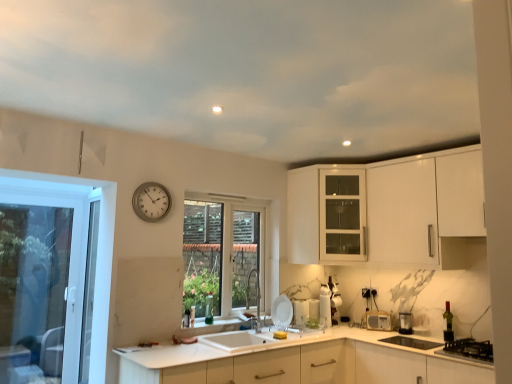
Where is `black matte gas stove at lower right`? This screenshot has height=384, width=512. black matte gas stove at lower right is located at coordinates (469, 350).

The image size is (512, 384). What do you see at coordinates (325, 306) in the screenshot?
I see `white glossy soap dispenser at center, placed as the 2th appliance when sorted from left to right` at bounding box center [325, 306].

The height and width of the screenshot is (384, 512). Find the location of `green glass wine bottle at sink, the 2th wine bottle from the front`. green glass wine bottle at sink, the 2th wine bottle from the front is located at coordinates tap(209, 309).

Describe the element at coordinates (282, 312) in the screenshot. This screenshot has height=384, width=512. I see `white glossy plate at sink, the first appliance positioned from the left` at that location.

What do you see at coordinates (448, 324) in the screenshot? I see `green glass bottle at lower right, positioned as the 2th wine bottle in back-to-front order` at bounding box center [448, 324].

Image resolution: width=512 pixels, height=384 pixels. I want to click on silver metallic clock at upper left, so click(x=151, y=201).

Is green glass wine bottle at sink, which appears as the first wine bottle when viewed from the left, far away from white glossy microwave at lower center, which is the 3th appliance in left-to-right order?

Yes, green glass wine bottle at sink, which appears as the first wine bottle when viewed from the left, and white glossy microwave at lower center, which is the 3th appliance in left-to-right order, are located far from each other.

You are a GUI agent. You are given a task and a screenshot of the screen. Output one action in this format:
    pyautogui.click(x=<x>, y=<y>)
    Task: Click on the 1st wine bottle in front of the white glossy microwave at lower center, which is the 3th appliance in left-to-right order
    
    Given the screenshot: What is the action you would take?
    pyautogui.click(x=209, y=309)

Can you confirm if green glass wine bottle at sink, which is the 1th wine bottle from back to front, is shorter than white glossy microwave at lower center, which is the 3th appliance in left-to-right order?

In fact, green glass wine bottle at sink, which is the 1th wine bottle from back to front, may be taller than white glossy microwave at lower center, which is the 3th appliance in left-to-right order.

In the scene shown: From the image's perspective, is green glass wine bottle at sink, which is the 1th wine bottle from back to front, above or below white glossy microwave at lower center, which is the 3th appliance in left-to-right order?

Based on their image positions, green glass wine bottle at sink, which is the 1th wine bottle from back to front, is located above white glossy microwave at lower center, which is the 3th appliance in left-to-right order.

Considering the sizes of objects transparent glass door at left, marked as the 1th window in a left-to-right arrangement, and silver metallic clock at upper left in the image provided, who is taller, transparent glass door at left, marked as the 1th window in a left-to-right arrangement, or silver metallic clock at upper left?

With more height is transparent glass door at left, marked as the 1th window in a left-to-right arrangement.

Image resolution: width=512 pixels, height=384 pixels. What are the coordinates of `clock on the right of transparent glass door at left, the second window viewed from the right` in the screenshot? It's located at (151, 201).

From a real-world perspective, who is located higher, transparent glass door at left, marked as the 1th window in a left-to-right arrangement, or silver metallic clock at upper left?

silver metallic clock at upper left is physically above.

Is transparent glass door at left, marked as the 1th window in a left-to-right arrangement, at the right side of silver metallic clock at upper left?

No.

Is silver metallic clock at upper left surrounding white glossy microwave at lower center, which appears as the 2th appliance when viewed from the right?

No, white glossy microwave at lower center, which appears as the 2th appliance when viewed from the right, is not a part of silver metallic clock at upper left.

Find the location of a particular element. This screenshot has height=384, width=512. the 4th appliance directly beneath the silver metallic clock at upper left (from a real-world perspective) is located at coordinates (378, 320).

Is clear glass window at center, the first window positioned from the right, at the left side of white glossy soap dispenser at center, placed as the 2th appliance when sorted from left to right?

Yes.

Considering the relative positions of clear glass window at center, the first window positioned from the right, and white glossy soap dispenser at center, which ranks as the third appliance in right-to-left order, in the image provided, is clear glass window at center, the first window positioned from the right, behind white glossy soap dispenser at center, which ranks as the third appliance in right-to-left order,?

That is False.

Can we say clear glass window at center, the first window positioned from the right, lies outside white glossy soap dispenser at center, which ranks as the third appliance in right-to-left order?

Yes, clear glass window at center, the first window positioned from the right, is outside of white glossy soap dispenser at center, which ranks as the third appliance in right-to-left order.

Is clear glass window at center, the first window positioned from the right, taller than white glossy soap dispenser at center, placed as the 2th appliance when sorted from left to right?

Correct, clear glass window at center, the first window positioned from the right, is much taller as white glossy soap dispenser at center, placed as the 2th appliance when sorted from left to right.

Considering the positions of objects white glossy microwave at lower center, which appears as the 2th appliance when viewed from the right, and white glossy soap dispenser at center, which ranks as the third appliance in right-to-left order, in the image provided, who is in front, white glossy microwave at lower center, which appears as the 2th appliance when viewed from the right, or white glossy soap dispenser at center, which ranks as the third appliance in right-to-left order,?

white glossy microwave at lower center, which appears as the 2th appliance when viewed from the right.

Is white glossy microwave at lower center, which appears as the 2th appliance when viewed from the right, at the left side of white glossy soap dispenser at center, which ranks as the third appliance in right-to-left order?

No.

Does point (380, 316) lie in front of point (329, 323)?

Yes, point (380, 316) is in front of point (329, 323).

Between metallic silver toaster at lower right, which is the fourth appliance from left to right, and clear glass window at center, placed as the second window when sorted from left to right, which one appears on the right side from the viewer's perspective?

metallic silver toaster at lower right, which is the fourth appliance from left to right.

What's the angular difference between metallic silver toaster at lower right, positioned as the 1th appliance in right-to-left order, and clear glass window at center, the first window positioned from the right,'s facing directions?

They differ by 89.7 degrees in their facing directions.

Considering the relative sizes of metallic silver toaster at lower right, which is the fourth appliance from left to right, and clear glass window at center, placed as the second window when sorted from left to right, in the image provided, is metallic silver toaster at lower right, which is the fourth appliance from left to right, thinner than clear glass window at center, placed as the second window when sorted from left to right,?

Incorrect, the width of metallic silver toaster at lower right, which is the fourth appliance from left to right, is not less than that of clear glass window at center, placed as the second window when sorted from left to right.

In terms of height, does metallic silver toaster at lower right, positioned as the 1th appliance in right-to-left order, look taller or shorter compared to clear glass window at center, the first window positioned from the right?

In the image, metallic silver toaster at lower right, positioned as the 1th appliance in right-to-left order, appears to be shorter than clear glass window at center, the first window positioned from the right.

Are white glossy microwave at lower center, which appears as the 2th appliance when viewed from the right, and white glossy plate at sink, the first appliance positioned from the left, located far from each other?

No, white glossy microwave at lower center, which appears as the 2th appliance when viewed from the right, is not far away from white glossy plate at sink, the first appliance positioned from the left.

Does point (382, 317) come behind point (278, 301)?

Yes, it is.

Which object is wider, white glossy microwave at lower center, which is the 3th appliance in left-to-right order, or white glossy plate at sink, placed as the fourth appliance when sorted from right to left?

With larger width is white glossy microwave at lower center, which is the 3th appliance in left-to-right order.

Who is bigger, white glossy microwave at lower center, which is the 3th appliance in left-to-right order, or white glossy plate at sink, placed as the fourth appliance when sorted from right to left?

white glossy plate at sink, placed as the fourth appliance when sorted from right to left, is bigger.

Starting from the green glass wine bottle at sink, which appears as the first wine bottle when viewed from the left, which appliance is the 3rd one behind? Please provide its 2D coordinates.

[(378, 320)]

From a real-world perspective, which window is the 2nd one underneath the silver metallic clock at upper left? Please provide its 2D coordinates.

[(75, 254)]

From the image, which object appears to be nearer to clear glass window at center, placed as the second window when sorted from left to right, white glossy microwave at lower center, which is the 3th appliance in left-to-right order, or white matte countertop at center?

white matte countertop at center is positioned closer to the anchor clear glass window at center, placed as the second window when sorted from left to right.

Estimate the real-world distances between objects in this image. Which object is closer to white glossy microwave at lower center, which appears as the 2th appliance when viewed from the right, silver metallic clock at upper left or metallic silver toaster at lower right, positioned as the 1th appliance in right-to-left order?

metallic silver toaster at lower right, positioned as the 1th appliance in right-to-left order.

Which object lies further to the anchor point white matte countertop at center, metallic silver toaster at lower right, which is the fourth appliance from left to right, or black matte gas stove at lower right?

metallic silver toaster at lower right, which is the fourth appliance from left to right.

Considering their positions, is white glossy cabinet at upper center positioned further to white glossy plate at sink, placed as the fourth appliance when sorted from right to left, than white matte countertop at center?

white glossy cabinet at upper center.

Looking at the image, which one is located further to white glossy plate at sink, placed as the fourth appliance when sorted from right to left, green glass wine bottle at sink, the second wine bottle in the right-to-left sequence, or black matte gas stove at lower right?

black matte gas stove at lower right is further to white glossy plate at sink, placed as the fourth appliance when sorted from right to left.

Estimate the real-world distances between objects in this image. Which object is closer to transparent glass door at left, marked as the 1th window in a left-to-right arrangement, green glass wine bottle at sink, the second wine bottle in the right-to-left sequence, or white matte countertop at center?

The object closer to transparent glass door at left, marked as the 1th window in a left-to-right arrangement, is green glass wine bottle at sink, the second wine bottle in the right-to-left sequence.

When comparing their distances from white glossy plate at sink, the first appliance positioned from the left, does green glass bottle at lower right, the second wine bottle from the left, or clear glass window at center, the first window positioned from the right, seem closer?

clear glass window at center, the first window positioned from the right, lies closer to white glossy plate at sink, the first appliance positioned from the left, than the other object.

Considering their positions, is white glossy soap dispenser at center, placed as the 2th appliance when sorted from left to right, positioned closer to black matte gas stove at lower right than green glass wine bottle at sink, the 2th wine bottle from the front?

white glossy soap dispenser at center, placed as the 2th appliance when sorted from left to right.

The height and width of the screenshot is (384, 512). I want to click on window between silver metallic clock at upper left and white glossy cabinet at upper center in the horizontal direction, so coord(223,255).

The width and height of the screenshot is (512, 384). I want to click on clock between transparent glass door at left, marked as the 1th window in a left-to-right arrangement, and clear glass window at center, the first window positioned from the right, from left to right, so click(x=151, y=201).

Locate an element on the screen. cabinetry between green glass wine bottle at sink, which appears as the first wine bottle when viewed from the left, and white glossy microwave at lower center, which appears as the 2th appliance when viewed from the right, from left to right is located at coordinates point(326,215).

Where is `countertop between green glass wine bottle at sink, which is the 1th wine bottle from back to front, and green glass bottle at lower right, the second wine bottle from the left, from left to right`? countertop between green glass wine bottle at sink, which is the 1th wine bottle from back to front, and green glass bottle at lower right, the second wine bottle from the left, from left to right is located at coordinates (296, 361).